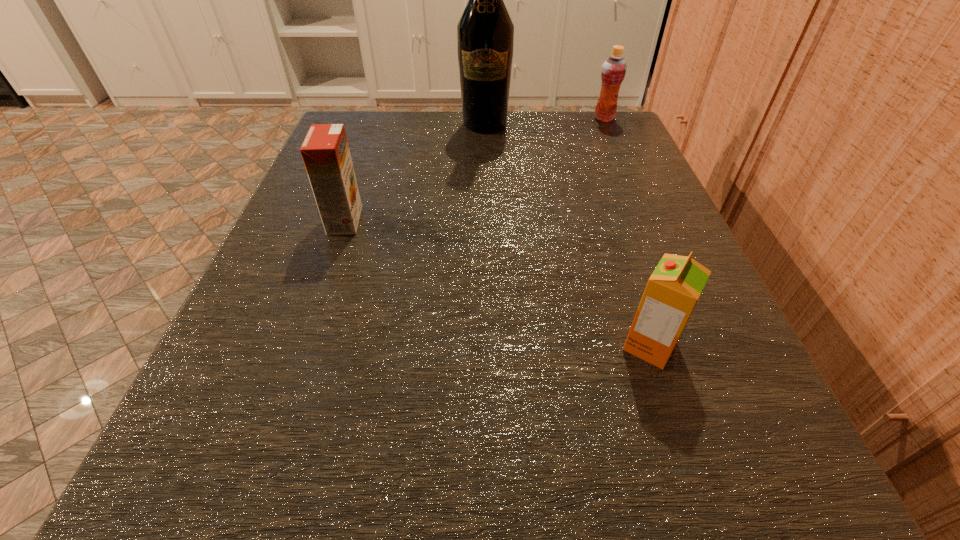
This screenshot has width=960, height=540. I want to click on free area in between the third object from right to left and the rightmost orange juice, so click(544, 121).

The image size is (960, 540). Identify the location of free space between the rightmost orange juice and the second object from right to left. (627, 232).

Identify which object is located as the nearest to the tallest object. Please provide its 2D coordinates. Your answer should be formatted as a tuple, i.e. [(x, y)], where the tuple contains the x and y coordinates of a point satisfying the conditions above.

[(614, 68)]

The width and height of the screenshot is (960, 540). Find the location of `object that stands as the second closest to the wine bottle`. object that stands as the second closest to the wine bottle is located at coordinates (325, 151).

Identify which orange juice is the nearest to the second nearest orange juice. Please provide its 2D coordinates. Your answer should be formatted as a tuple, i.e. [(x, y)], where the tuple contains the x and y coordinates of a point satisfying the conditions above.

[(673, 289)]

Locate which orange juice ranks second in proximity to the rightmost orange juice. Please provide its 2D coordinates. Your answer should be formatted as a tuple, i.e. [(x, y)], where the tuple contains the x and y coordinates of a point satisfying the conditions above.

[(673, 289)]

Where is `free spot that satisfies the following two spatial constraints: 1. on the label of the second object from right to left; 2. on the left side of the third object from right to left`? free spot that satisfies the following two spatial constraints: 1. on the label of the second object from right to left; 2. on the left side of the third object from right to left is located at coordinates 489,346.

Identify the location of vacant region that satisfies the following two spatial constraints: 1. on the back side of the rightmost object; 2. on the right side of the nearest orange juice. The width and height of the screenshot is (960, 540). (574, 118).